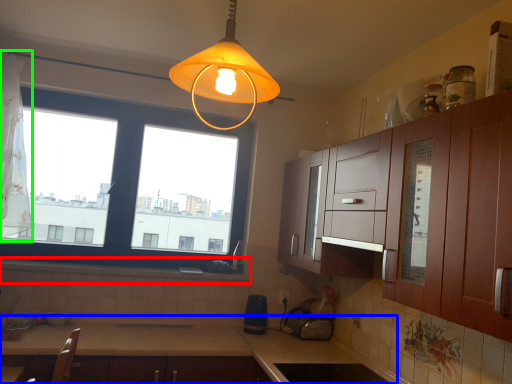
Question: Which object is the closest to the window sill (highlighted by a red box)? Choose among these: countertop (highlighted by a blue box) or curtain (highlighted by a green box).

Choices:
 (A) countertop
 (B) curtain

Answer: (A)